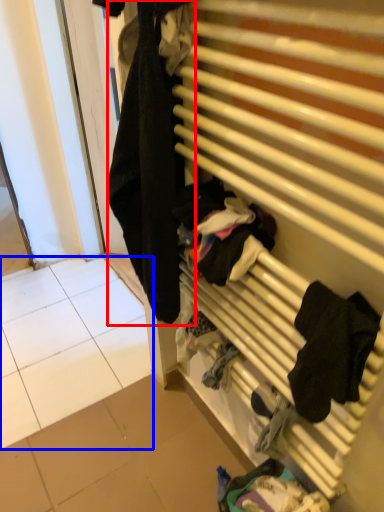
Question: Which object is further to the camera taking this photo, clothing (highlighted by a red box) or tile (highlighted by a blue box)?

Choices:
 (A) clothing
 (B) tile

Answer: (B)